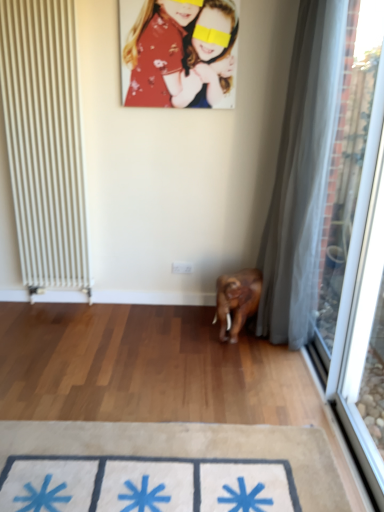
Question: Does transparent fabric at right have a lesser width compared to floral fabric portrait at upper center?

Choices:
 (A) no
 (B) yes

Answer: (A)

Question: Is there a large distance between transparent fabric at right and floral fabric portrait at upper center?

Choices:
 (A) no
 (B) yes

Answer: (B)

Question: Can you confirm if transparent fabric at right is positioned to the left of floral fabric portrait at upper center?

Choices:
 (A) yes
 (B) no

Answer: (B)

Question: Can floral fabric portrait at upper center be found inside transparent fabric at right?

Choices:
 (A) no
 (B) yes

Answer: (A)

Question: From a real-world perspective, is transparent fabric at right located higher than floral fabric portrait at upper center?

Choices:
 (A) no
 (B) yes

Answer: (A)

Question: Could you tell me if transparent fabric at right is turned towards floral fabric portrait at upper center?

Choices:
 (A) no
 (B) yes

Answer: (A)

Question: Is beige fabric doormat at lower center touching transparent fabric at right?

Choices:
 (A) no
 (B) yes

Answer: (A)

Question: Can you confirm if beige fabric doormat at lower center is thinner than transparent fabric at right?

Choices:
 (A) yes
 (B) no

Answer: (B)

Question: Is beige fabric doormat at lower center far from transparent fabric at right?

Choices:
 (A) no
 (B) yes

Answer: (B)

Question: Is beige fabric doormat at lower center positioned with its back to transparent fabric at right?

Choices:
 (A) no
 (B) yes

Answer: (A)

Question: From the image's perspective, is beige fabric doormat at lower center above transparent fabric at right?

Choices:
 (A) no
 (B) yes

Answer: (A)

Question: Is beige fabric doormat at lower center at the left side of transparent fabric at right?

Choices:
 (A) yes
 (B) no

Answer: (A)

Question: Considering the relative sizes of floral fabric portrait at upper center and transparent fabric at right in the image provided, is floral fabric portrait at upper center taller than transparent fabric at right?

Choices:
 (A) yes
 (B) no

Answer: (B)